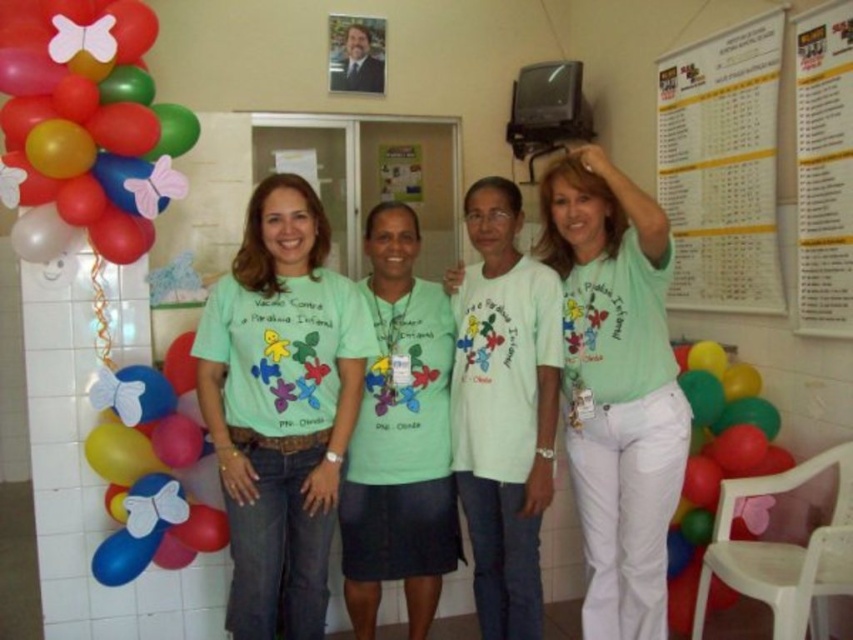
Question: Estimate the real-world distances between objects in this image. Which object is closer to the multicolored glossy balloons at left?

Choices:
 (A) yellow paper at upper right
 (B) matte green shirt at center
 (C) white paper calendar at upper right
 (D) green matte shirt at center

Answer: (D)

Question: From the image, what is the correct spatial relationship of multicolored glossy balloons at left in relation to yellow paper at upper right?

Choices:
 (A) left
 (B) right

Answer: (A)

Question: Which point is farther from the camera taking this photo?

Choices:
 (A) (688, 396)
 (B) (700, 237)

Answer: (B)

Question: Among these points, which one is farthest from the camera?

Choices:
 (A) (184, 358)
 (B) (752, 465)
 (C) (288, 616)
 (D) (10, 186)

Answer: (B)

Question: Where is matte multicolored balloons at left located in relation to yellow paper at upper right in the image?

Choices:
 (A) below
 (B) above

Answer: (A)

Question: Is multicolored glossy balloons at left further to camera compared to yellow paper at upper right?

Choices:
 (A) yes
 (B) no

Answer: (B)